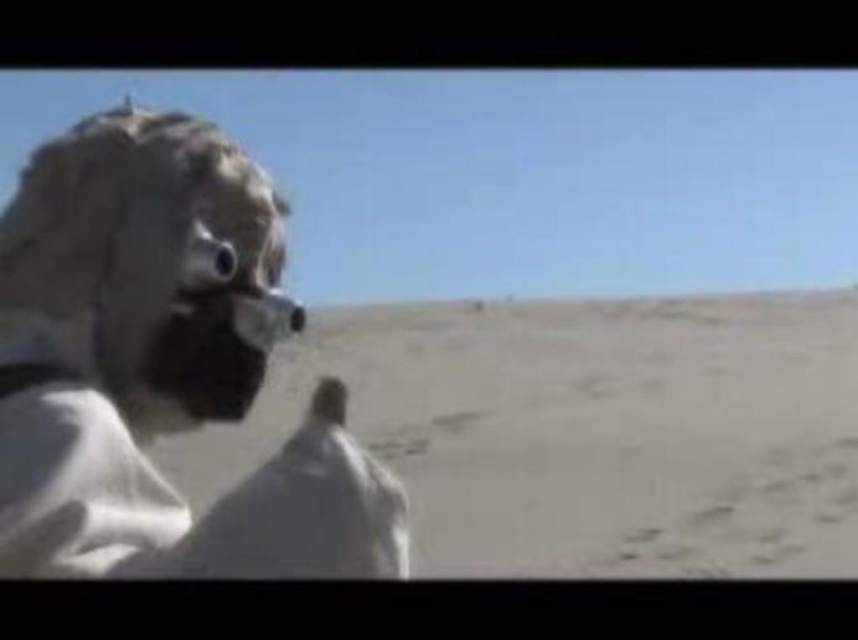
Question: Is smooth beige sand at center in front of white matte mask at left?

Choices:
 (A) yes
 (B) no

Answer: (B)

Question: Can you confirm if smooth beige sand at center is positioned below white matte mask at left?

Choices:
 (A) no
 (B) yes

Answer: (B)

Question: Which of the following is the closest to the observer?

Choices:
 (A) white matte mask at left
 (B) smooth beige sand at center

Answer: (A)

Question: Is smooth beige sand at center thinner than white matte mask at left?

Choices:
 (A) yes
 (B) no

Answer: (B)